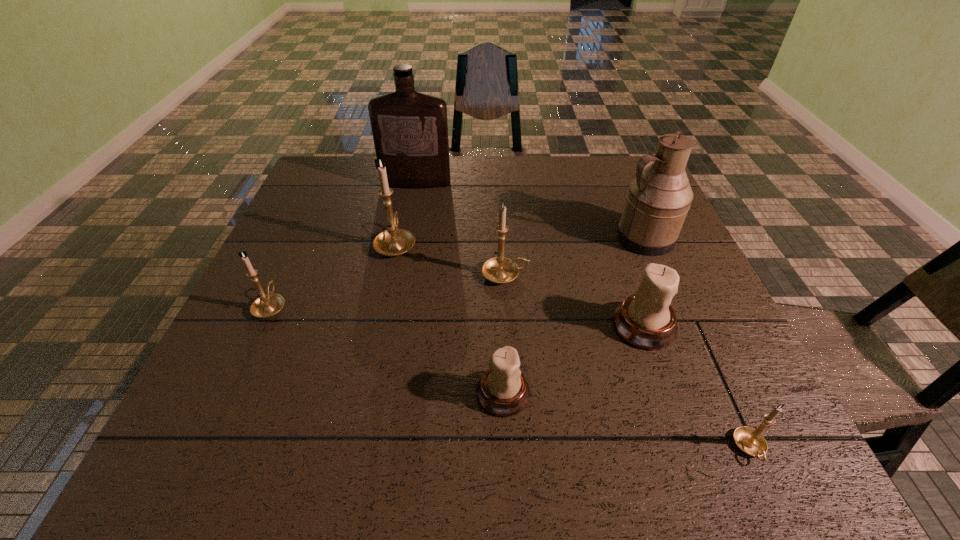
I want to click on free space that satisfies the following two spatial constraints: 1. on the label side of the pitcher; 2. on the right side of the liquor, so click(405, 238).